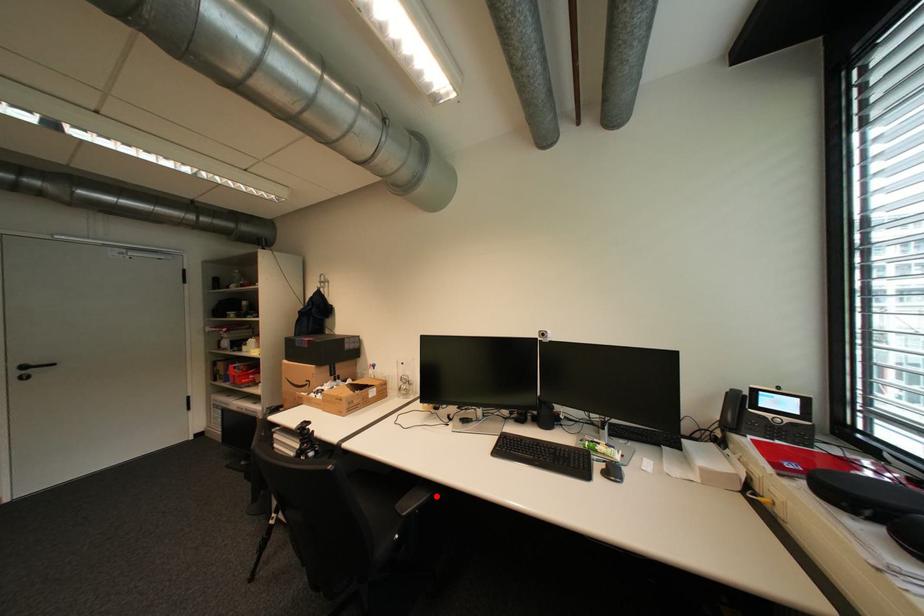
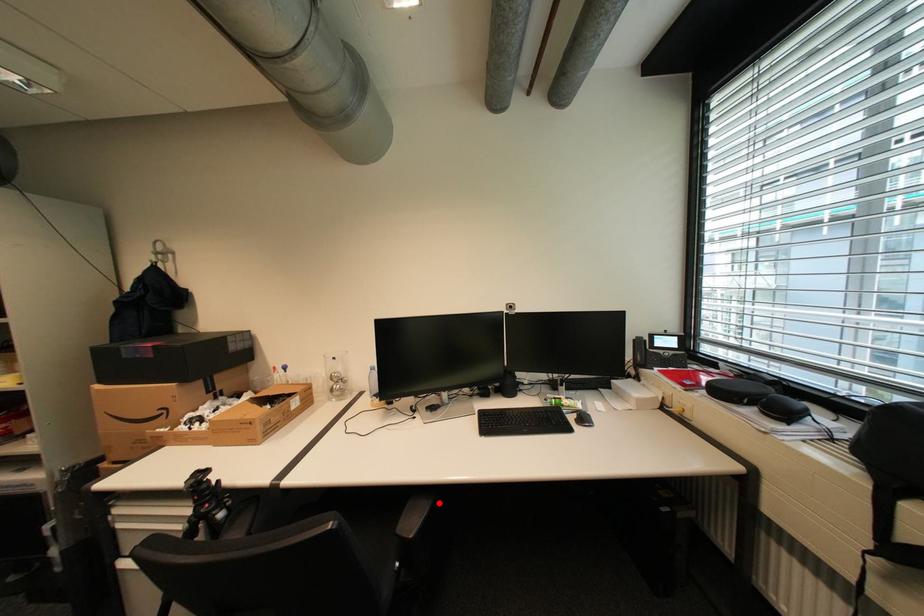
I am providing you with two images of the same scene from different viewpoints. A red point is marked on the first image and another point is marked on the second image. Is the marked point in image1 the same physical position as the marked point in image2?

Yes